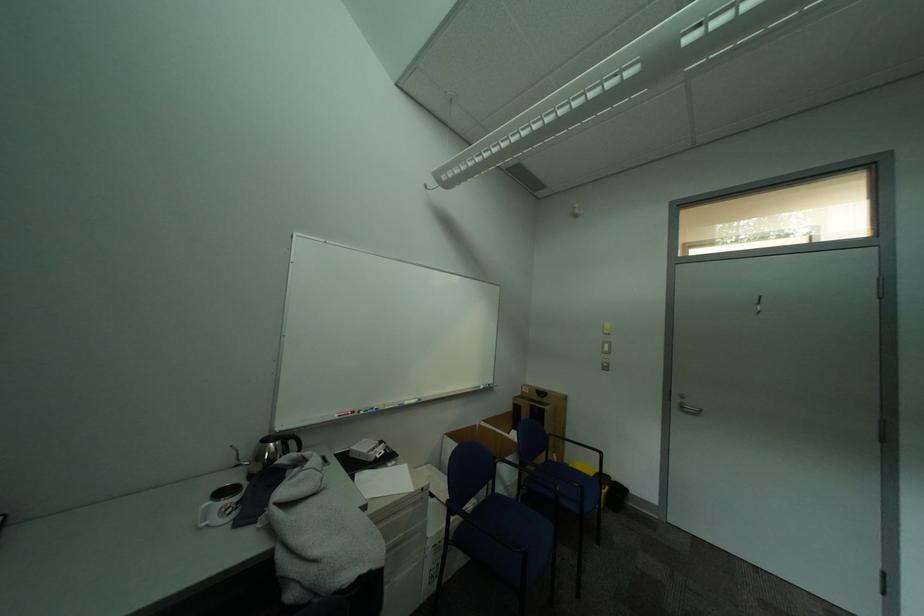
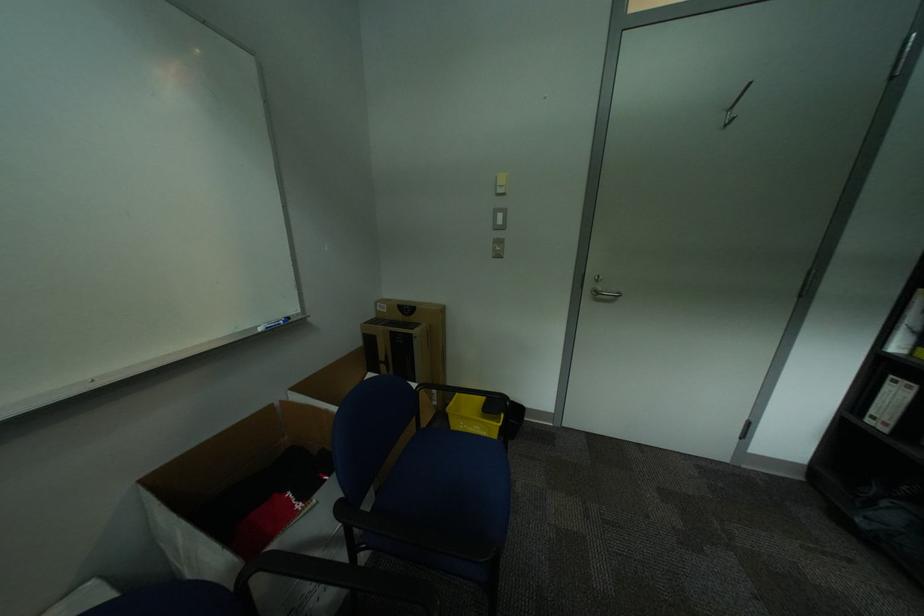
The point at (491, 387) is marked in the first image. Where is the corresponding point in the second image?

(266, 329)